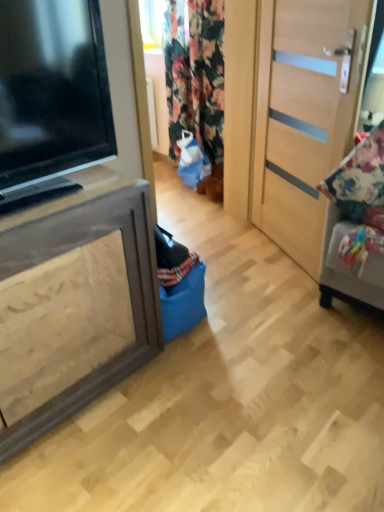
This screenshot has height=512, width=384. I want to click on vacant space in between light wood door at right and brown wood cabinet at left, so click(x=235, y=294).